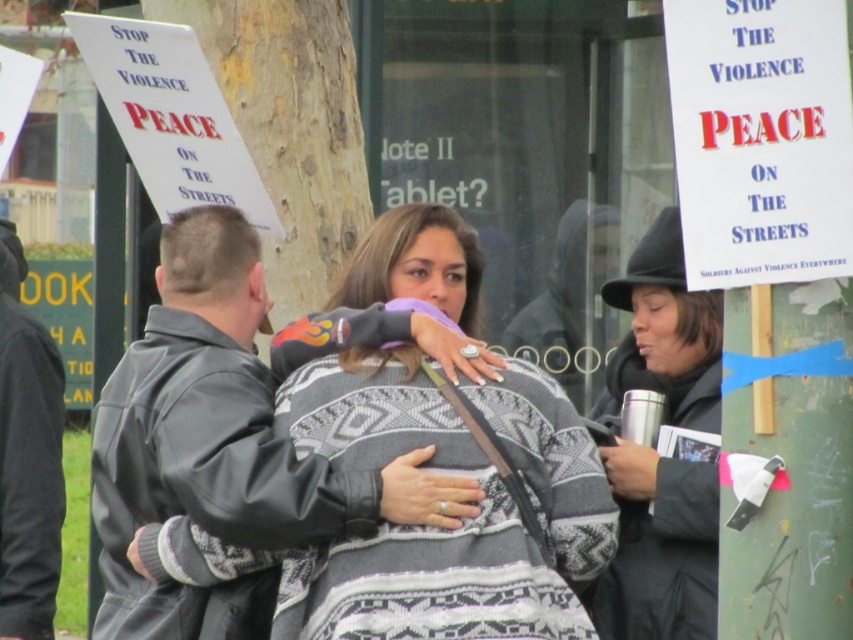
Does black woolen hat at upper right have a smaller size compared to black leather jacket at left?

Incorrect, black woolen hat at upper right is not smaller in size than black leather jacket at left.

Which of these two, black woolen hat at upper right or black leather jacket at left, stands shorter?

black woolen hat at upper right

Is point (599, 620) in front of point (35, 502)?

Yes, it is in front of point (35, 502).

This screenshot has width=853, height=640. What are the coordinates of `black woolen hat at upper right` in the screenshot? It's located at (659, 548).

Who is higher up, leather jacket at center or black leather jacket at left?

leather jacket at center is higher up.

Where is `leather jacket at center`? The width and height of the screenshot is (853, 640). leather jacket at center is located at coordinates (218, 424).

Does point (300, 497) come in front of point (33, 435)?

Yes, point (300, 497) is in front of point (33, 435).

What are the coordinates of `leather jacket at center` in the screenshot? It's located at (218, 424).

Which of these two, leather jacket at center or black woolen hat at upper right, stands taller?

With more height is black woolen hat at upper right.

Does leather jacket at center have a larger size compared to black woolen hat at upper right?

Correct, leather jacket at center is larger in size than black woolen hat at upper right.

Is point (347, 518) less distant than point (625, 516)?

Yes, point (347, 518) is closer to viewer.

You are a GUI agent. You are given a task and a screenshot of the screen. Output one action in this format:
    pyautogui.click(x=<x>, y=<y>)
    Task: Click on the leather jacket at center
    The width and height of the screenshot is (853, 640).
    Given the screenshot: What is the action you would take?
    pyautogui.click(x=218, y=424)